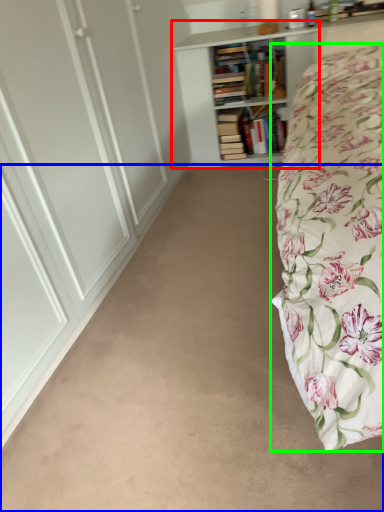
Question: Estimate the real-world distances between objects in this image. Which object is farther from bookcase (highlighted by a red box), plain (highlighted by a blue box) or bed (highlighted by a green box)?

Choices:
 (A) plain
 (B) bed

Answer: (A)